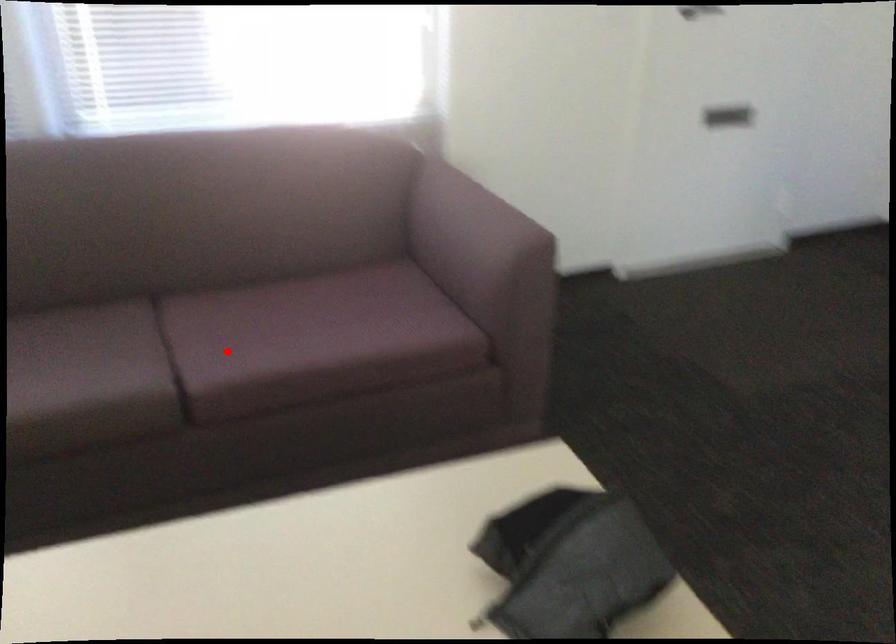
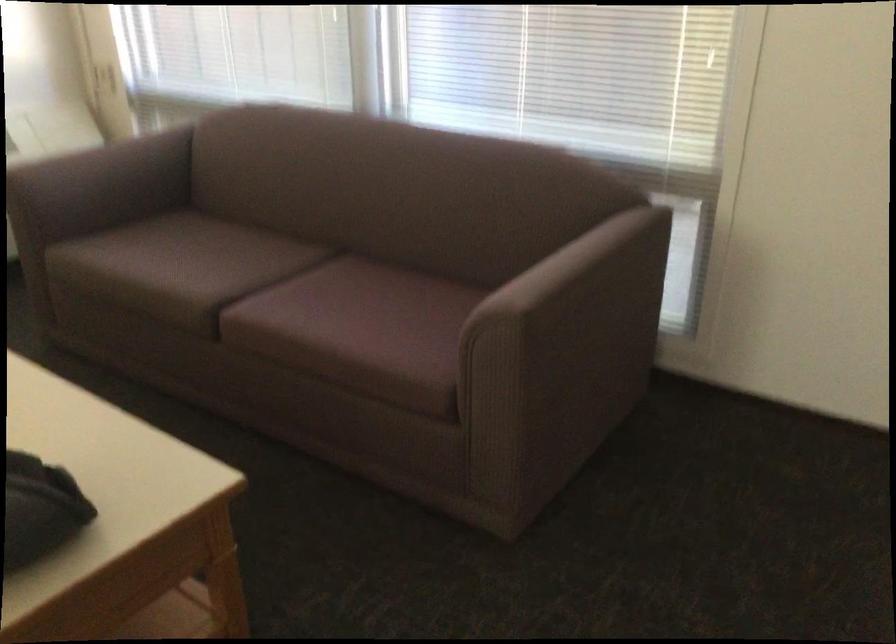
Where in the second image is the point corresponding to the highlighted location from the first image?

(277, 299)